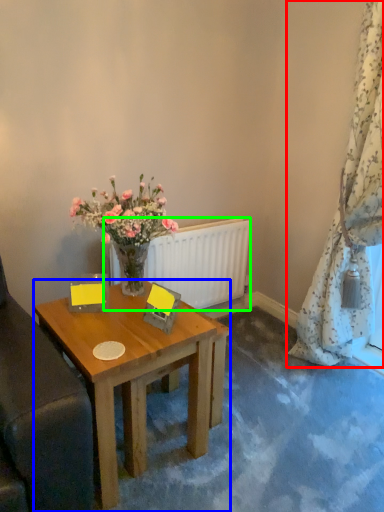
Question: Which object is the closest to the curtain (highlighted by a red box)? Choose among these: desk (highlighted by a blue box) or radiator (highlighted by a green box).

Choices:
 (A) desk
 (B) radiator

Answer: (B)